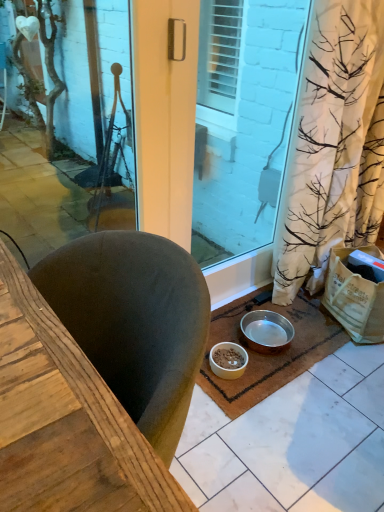
This screenshot has height=512, width=384. Describe the element at coordinates (243, 121) in the screenshot. I see `transparent glass screen door at center` at that location.

The height and width of the screenshot is (512, 384). What are the coordinates of `transparent glass screen door at center` in the screenshot? It's located at (243, 121).

Could you tell me if brown coir mat at lower center is turned towards metallic silver bowl at lower center, which appears as the 2th bowl when viewed from the left?

No, brown coir mat at lower center is not aimed at metallic silver bowl at lower center, which appears as the 2th bowl when viewed from the left.

Image resolution: width=384 pixels, height=512 pixels. Identify the location of doormat on the left of the metallic silver bowl at lower center, which appears as the 2th bowl when viewed from the left. (269, 355).

Which object is thinner, brown coir mat at lower center or metallic silver bowl at lower center, which appears as the 2th bowl when viewed from the left?

metallic silver bowl at lower center, which appears as the 2th bowl when viewed from the left.

From a real-world perspective, is brown coir mat at lower center positioned above or below metallic silver bowl at lower center, placed as the first bowl when sorted from right to left?

brown coir mat at lower center is below metallic silver bowl at lower center, placed as the first bowl when sorted from right to left.

Considering the points (223, 335) and (244, 85), which point is in front, point (223, 335) or point (244, 85)?

The point (244, 85) is closer.

From the picture: From a real-world perspective, is brown coir mat at lower center positioned above or below transparent glass screen door at center?

brown coir mat at lower center is below transparent glass screen door at center.

Considering the relative positions of brown coir mat at lower center and transparent glass screen door at center in the image provided, is brown coir mat at lower center behind transparent glass screen door at center?

Yes, it is behind transparent glass screen door at center.

Which object is further away from the camera taking this photo, brown coir mat at lower center or white matte bowl at lower center, arranged as the 2th bowl when viewed from the right?

white matte bowl at lower center, arranged as the 2th bowl when viewed from the right, is behind.

Is brown coir mat at lower center situated inside white matte bowl at lower center, arranged as the 2th bowl when viewed from the right, or outside?

brown coir mat at lower center is not enclosed by white matte bowl at lower center, arranged as the 2th bowl when viewed from the right.

At what (x,y) coordinates should I click in order to perform the action: click on doormat below the white matte bowl at lower center, the first bowl when ordered from left to right (from a real-world perspective). Please return your answer as a coordinate pair (x, y). The image size is (384, 512). Looking at the image, I should click on (269, 355).

Is brown coir mat at lower center not close to white matte bowl at lower center, arranged as the 2th bowl when viewed from the right?

Actually, brown coir mat at lower center and white matte bowl at lower center, arranged as the 2th bowl when viewed from the right, are a little close together.

From the image's perspective, is transparent glass screen door at center below brown coir mat at lower center?

No, from the image's perspective, transparent glass screen door at center is not below brown coir mat at lower center.

This screenshot has height=512, width=384. I want to click on screen door in front of the brown coir mat at lower center, so coord(243,121).

Could brown coir mat at lower center be considered to be inside transparent glass screen door at center?

Definitely not — brown coir mat at lower center is not inside transparent glass screen door at center.

Is brown coir mat at lower center inside metallic silver bowl at lower center, placed as the first bowl when sorted from right to left?

Actually, brown coir mat at lower center is outside metallic silver bowl at lower center, placed as the first bowl when sorted from right to left.

Considering the points (279, 328) and (315, 302), which point is behind, point (279, 328) or point (315, 302)?

The point (315, 302) is behind.

Is metallic silver bowl at lower center, placed as the first bowl when sorted from right to left, further to camera compared to brown coir mat at lower center?

Yes, the depth of metallic silver bowl at lower center, placed as the first bowl when sorted from right to left, is greater than that of brown coir mat at lower center.

Could you tell me if metallic silver bowl at lower center, which appears as the 2th bowl when viewed from the left, is turned towards brown coir mat at lower center?

No, metallic silver bowl at lower center, which appears as the 2th bowl when viewed from the left, is not aimed at brown coir mat at lower center.

Based on the photo, is transparent glass screen door at center aimed at white matte bowl at lower center, arranged as the 2th bowl when viewed from the right?

Yes, transparent glass screen door at center is facing white matte bowl at lower center, arranged as the 2th bowl when viewed from the right.

Is point (285, 89) in front of point (236, 348)?

That is False.

At what (x,y) coordinates should I click in order to perform the action: click on bowl that appears on the left of transparent glass screen door at center. Please return your answer as a coordinate pair (x, y). Image resolution: width=384 pixels, height=512 pixels. Looking at the image, I should click on (228, 360).

Which object is further away from the camera taking this photo, transparent glass screen door at center or white matte bowl at lower center, arranged as the 2th bowl when viewed from the right?

Positioned behind is white matte bowl at lower center, arranged as the 2th bowl when viewed from the right.

How distant is metallic silver bowl at lower center, placed as the first bowl when sorted from right to left, from white matte bowl at lower center, the first bowl when ordered from left to right?

metallic silver bowl at lower center, placed as the first bowl when sorted from right to left, is 6.01 inches away from white matte bowl at lower center, the first bowl when ordered from left to right.

Does metallic silver bowl at lower center, placed as the first bowl when sorted from right to left, have a greater height compared to white matte bowl at lower center, arranged as the 2th bowl when viewed from the right?

Indeed, metallic silver bowl at lower center, placed as the first bowl when sorted from right to left, has a greater height compared to white matte bowl at lower center, arranged as the 2th bowl when viewed from the right.

Is metallic silver bowl at lower center, placed as the first bowl when sorted from right to left, inside or outside of white matte bowl at lower center, arranged as the 2th bowl when viewed from the right?

metallic silver bowl at lower center, placed as the first bowl when sorted from right to left, is spatially situated outside white matte bowl at lower center, arranged as the 2th bowl when viewed from the right.

Are metallic silver bowl at lower center, placed as the first bowl when sorted from right to left, and white matte bowl at lower center, arranged as the 2th bowl when viewed from the right, located far from each other?

That's not correct — metallic silver bowl at lower center, placed as the first bowl when sorted from right to left, is a little close to white matte bowl at lower center, arranged as the 2th bowl when viewed from the right.

The height and width of the screenshot is (512, 384). Find the location of `doormat lying below the metallic silver bowl at lower center, which appears as the 2th bowl when viewed from the left (from the image's perspective)`. doormat lying below the metallic silver bowl at lower center, which appears as the 2th bowl when viewed from the left (from the image's perspective) is located at coordinates (x=269, y=355).

In the image, there is a transparent glass screen door at center. Where is `doormat below it (from a real-world perspective)`? Image resolution: width=384 pixels, height=512 pixels. doormat below it (from a real-world perspective) is located at coordinates (269, 355).

In the scene shown: Which object lies nearer to the anchor point white matte bowl at lower center, arranged as the 2th bowl when viewed from the right, metallic silver bowl at lower center, which appears as the 2th bowl when viewed from the left, or brown coir mat at lower center?

The object closer to white matte bowl at lower center, arranged as the 2th bowl when viewed from the right, is metallic silver bowl at lower center, which appears as the 2th bowl when viewed from the left.

Considering their positions, is brown coir mat at lower center positioned further to metallic silver bowl at lower center, which appears as the 2th bowl when viewed from the left, than transparent glass screen door at center?

transparent glass screen door at center is positioned further to the anchor metallic silver bowl at lower center, which appears as the 2th bowl when viewed from the left.

Looking at the image, which one is located closer to white matte bowl at lower center, arranged as the 2th bowl when viewed from the right, brown coir mat at lower center or metallic silver bowl at lower center, placed as the first bowl when sorted from right to left?

metallic silver bowl at lower center, placed as the first bowl when sorted from right to left, is positioned closer to the anchor white matte bowl at lower center, arranged as the 2th bowl when viewed from the right.

Considering their positions, is white matte bowl at lower center, the first bowl when ordered from left to right, positioned closer to metallic silver bowl at lower center, which appears as the 2th bowl when viewed from the left, than transparent glass screen door at center?

The object closer to metallic silver bowl at lower center, which appears as the 2th bowl when viewed from the left, is white matte bowl at lower center, the first bowl when ordered from left to right.

Which object lies further to the anchor point metallic silver bowl at lower center, which appears as the 2th bowl when viewed from the left, brown coir mat at lower center or white matte bowl at lower center, arranged as the 2th bowl when viewed from the right?

white matte bowl at lower center, arranged as the 2th bowl when viewed from the right.

Based on their spatial positions, is white matte bowl at lower center, arranged as the 2th bowl when viewed from the right, or transparent glass screen door at center further from brown coir mat at lower center?

Among the two, transparent glass screen door at center is located further to brown coir mat at lower center.

Estimate the real-world distances between objects in this image. Which object is further from brown coir mat at lower center, transparent glass screen door at center or white matte bowl at lower center, arranged as the 2th bowl when viewed from the right?

transparent glass screen door at center is further to brown coir mat at lower center.

When comparing their distances from brown coir mat at lower center, does white matte bowl at lower center, the first bowl when ordered from left to right, or metallic silver bowl at lower center, placed as the first bowl when sorted from right to left, seem closer?

metallic silver bowl at lower center, placed as the first bowl when sorted from right to left, is closer to brown coir mat at lower center.

Locate an element on the screen. The height and width of the screenshot is (512, 384). bowl that lies between transparent glass screen door at center and white matte bowl at lower center, arranged as the 2th bowl when viewed from the right, from top to bottom is located at coordinates (267, 331).

The height and width of the screenshot is (512, 384). I want to click on bowl between transparent glass screen door at center and brown coir mat at lower center from top to bottom, so click(x=267, y=331).

I want to click on bowl between brown coir mat at lower center and metallic silver bowl at lower center, placed as the first bowl when sorted from right to left, along the z-axis, so click(x=228, y=360).

Locate an element on the screen. doormat between transparent glass screen door at center and white matte bowl at lower center, the first bowl when ordered from left to right, from top to bottom is located at coordinates (269, 355).